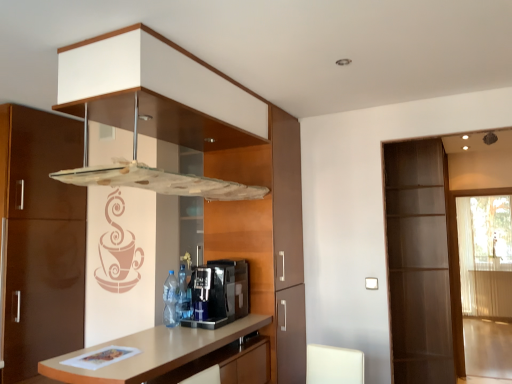
Question: Is blue plastic bottle at center, the first bottle from the front, in front of black plastic coffee machine at center?

Choices:
 (A) yes
 (B) no

Answer: (B)

Question: Is blue plastic bottle at center, the first bottle from the front, facing away from black plastic coffee machine at center?

Choices:
 (A) yes
 (B) no

Answer: (A)

Question: Is blue plastic bottle at center, the first bottle from the front, not within black plastic coffee machine at center?

Choices:
 (A) yes
 (B) no

Answer: (B)

Question: From a real-world perspective, is blue plastic bottle at center, the first bottle from the front, on black plastic coffee machine at center?

Choices:
 (A) no
 (B) yes

Answer: (A)

Question: From a real-world perspective, is blue plastic bottle at center, the first bottle from the front, below black plastic coffee machine at center?

Choices:
 (A) yes
 (B) no

Answer: (A)

Question: Is transparent glass screen door at right, marked as the 2th screen door in a right-to-left arrangement, bigger or smaller than blue plastic bottle at center, which is the second bottle from back to front?

Choices:
 (A) small
 (B) big

Answer: (B)

Question: Do you think transparent glass screen door at right, which ranks as the 1th screen door in left-to-right order, is within blue plastic bottle at center, which is the second bottle from back to front, or outside of it?

Choices:
 (A) outside
 (B) inside

Answer: (A)

Question: Considering the positions of transparent glass screen door at right, marked as the 2th screen door in a right-to-left arrangement, and blue plastic bottle at center, the first bottle from the front, in the image, is transparent glass screen door at right, marked as the 2th screen door in a right-to-left arrangement, wider or thinner than blue plastic bottle at center, the first bottle from the front,?

Choices:
 (A) wide
 (B) thin

Answer: (A)

Question: Considering the relative positions of transparent glass screen door at right, marked as the 2th screen door in a right-to-left arrangement, and blue plastic bottle at center, which is the second bottle from back to front, in the image provided, is transparent glass screen door at right, marked as the 2th screen door in a right-to-left arrangement, to the left or to the right of blue plastic bottle at center, which is the second bottle from back to front,?

Choices:
 (A) left
 (B) right

Answer: (B)

Question: Is translucent white screen door at right, acting as the first screen door starting from the right, to the left or to the right of light brown wood countertop at center in the image?

Choices:
 (A) left
 (B) right

Answer: (B)

Question: From a real-world perspective, relative to light brown wood countertop at center, is translucent white screen door at right, the 2th screen door from the left, vertically above or below?

Choices:
 (A) above
 (B) below

Answer: (A)

Question: Considering the positions of point (492, 208) and point (163, 372), is point (492, 208) closer or farther from the camera than point (163, 372)?

Choices:
 (A) farther
 (B) closer

Answer: (A)

Question: Relative to light brown wood countertop at center, is translucent white screen door at right, acting as the first screen door starting from the right, in front or behind?

Choices:
 (A) front
 (B) behind

Answer: (B)

Question: In terms of width, does light brown wood countertop at center look wider or thinner when compared to blue plastic bottle at center, arranged as the 1th bottle when viewed from the back?

Choices:
 (A) thin
 (B) wide

Answer: (B)

Question: Is light brown wood countertop at center bigger or smaller than blue plastic bottle at center, arranged as the 1th bottle when viewed from the back?

Choices:
 (A) small
 (B) big

Answer: (B)